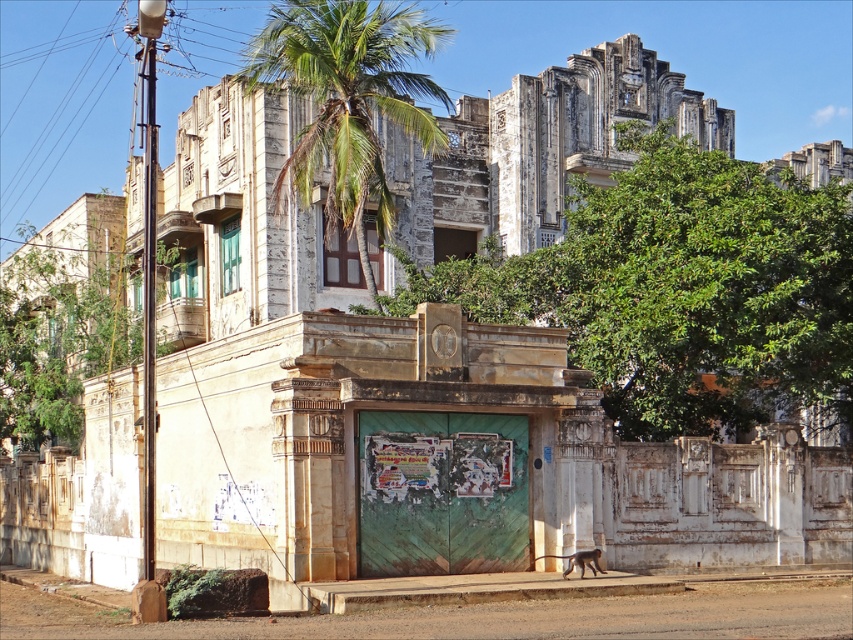
You are a visitor approaching the entrance of the building. You see the green leafy tree at center and the green leafy tree at left. Which tree is taller?

The green leafy tree at center is much taller than the green leafy tree at left.